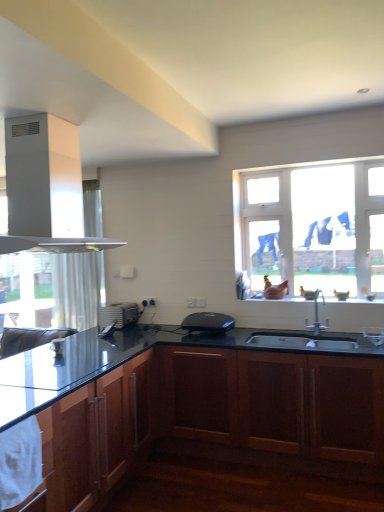
Question: Does white matte gas stove at upper left have a smaller size compared to black plastic toaster at center, the first appliance in the front-to-back sequence?

Choices:
 (A) no
 (B) yes

Answer: (A)

Question: Is white matte gas stove at upper left at the left side of black plastic toaster at center, the second appliance from the left?

Choices:
 (A) yes
 (B) no

Answer: (A)

Question: Would you say white matte gas stove at upper left is outside black plastic toaster at center, the second appliance from the left?

Choices:
 (A) yes
 (B) no

Answer: (A)

Question: Considering the relative positions of white matte gas stove at upper left and black plastic toaster at center, positioned as the first appliance in right-to-left order, in the image provided, is white matte gas stove at upper left behind black plastic toaster at center, positioned as the first appliance in right-to-left order,?

Choices:
 (A) yes
 (B) no

Answer: (B)

Question: Does white matte gas stove at upper left have a lesser width compared to black plastic toaster at center, the second appliance from the left?

Choices:
 (A) no
 (B) yes

Answer: (A)

Question: Could you tell me if white matte gas stove at upper left is facing black plastic toaster at center, positioned as the first appliance in right-to-left order?

Choices:
 (A) no
 (B) yes

Answer: (A)

Question: Considering the relative sizes of black plastic toaster at center, the 2th appliance in the back-to-front sequence, and matte glass window sill at center in the image provided, is black plastic toaster at center, the 2th appliance in the back-to-front sequence, taller than matte glass window sill at center?

Choices:
 (A) no
 (B) yes

Answer: (B)

Question: Is black plastic toaster at center, positioned as the first appliance in right-to-left order, looking in the opposite direction of matte glass window sill at center?

Choices:
 (A) yes
 (B) no

Answer: (B)

Question: Does black plastic toaster at center, the 2th appliance in the back-to-front sequence, have a lesser width compared to matte glass window sill at center?

Choices:
 (A) yes
 (B) no

Answer: (B)

Question: Can you confirm if black plastic toaster at center, positioned as the first appliance in right-to-left order, is shorter than matte glass window sill at center?

Choices:
 (A) yes
 (B) no

Answer: (B)

Question: Can you confirm if black plastic toaster at center, the second appliance from the left, is positioned to the right of matte glass window sill at center?

Choices:
 (A) no
 (B) yes

Answer: (A)

Question: From a real-world perspective, is black plastic toaster at center, the first appliance in the front-to-back sequence, on matte glass window sill at center?

Choices:
 (A) no
 (B) yes

Answer: (A)

Question: From the image's perspective, is satin silver toaster at lower center, marked as the 1th appliance in a left-to-right arrangement, located above glossy wood cabinet at lower left, acting as the 2th cabinetry starting from the right?

Choices:
 (A) yes
 (B) no

Answer: (A)